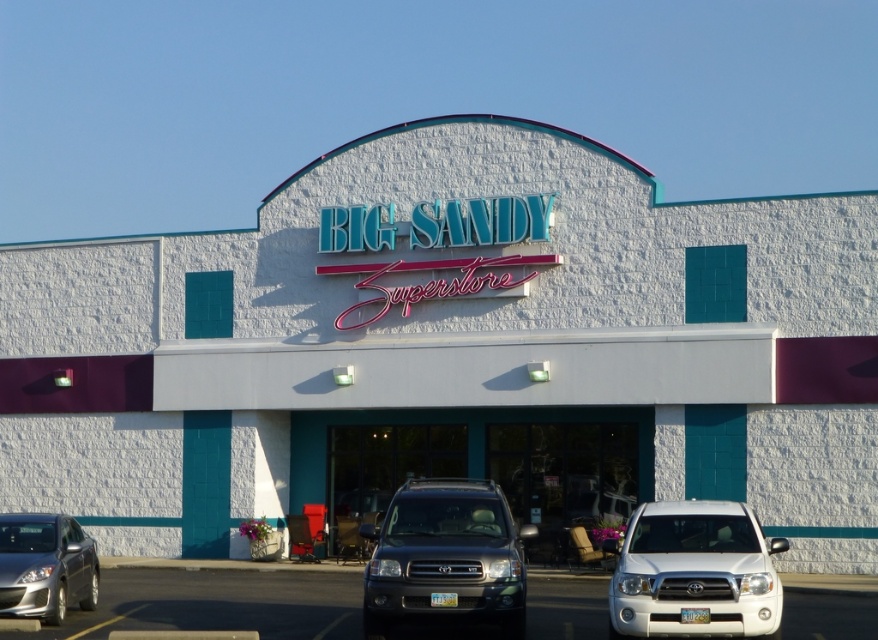
You are standing at the entrance of the retail store and want to know how far the white stucco building at center is from you. Can you determine the distance?

The white stucco building at center is 29.92 meters away from the viewer.

You are a delivery driver who needs to back up your truck to the loading dock behind the white stucco building at center. Your truck is 12 meters long. Can you safely back up your truck into the parking lot without hitting the silver metallic sedan at lower left?

The distance between the white stucco building at center and the silver metallic sedan at lower left is 10.65 meters. Since your truck is 12 meters long, which is longer than the available space, you cannot safely back up without risking collision with the silver metallic sedan at lower left.

You are standing in front of the Big Sandy Superstore and want to walk to the point that is closer to you. Which point should you go to, point (92, 621) or point (47, 536)?

You should go to point (92, 621) because it is closer to the viewer than point (47, 536).